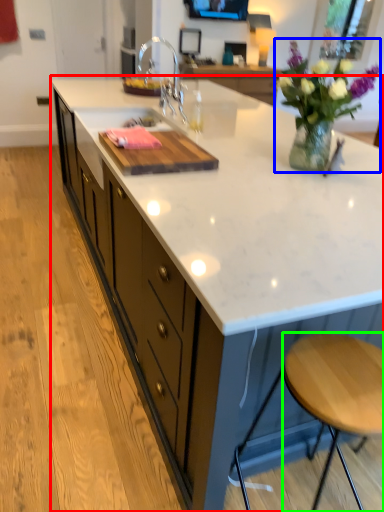
Question: Considering the real-world distances, which object is farthest from countertop (highlighted by a red box)? floral arrangement (highlighted by a blue box) or stool (highlighted by a green box)?

Choices:
 (A) floral arrangement
 (B) stool

Answer: (B)